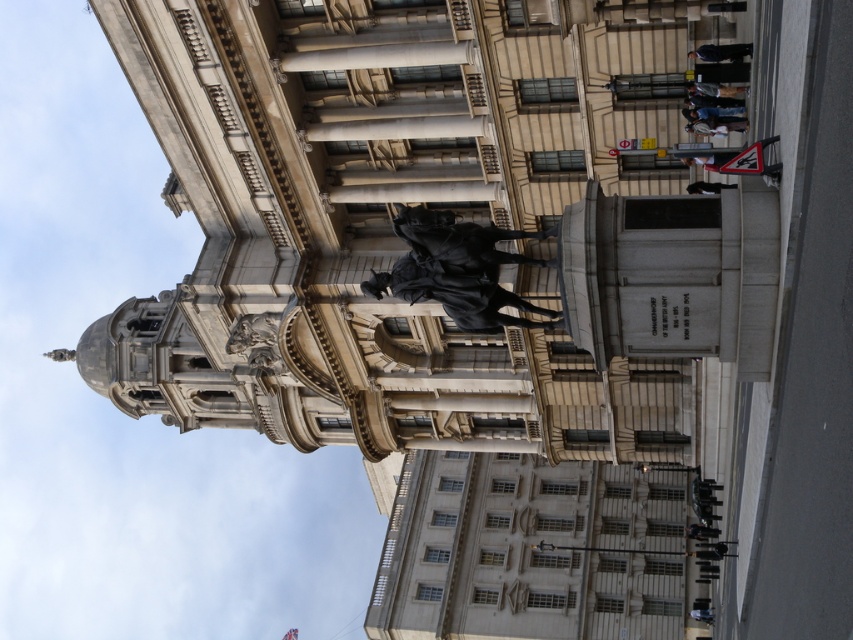
Does polished bronze statue at center have a larger size compared to black leather jacket at upper right?

Yes.

Does polished bronze statue at center have a greater height compared to black leather jacket at upper right?

Yes.

Which is in front, point (410, 273) or point (711, 68)?

Point (410, 273) is more forward.

Where is `polished bronze statue at center`? polished bronze statue at center is located at coordinates (457, 269).

Does polished bronze statue at center have a smaller size compared to black fabric at lower right?

No.

Is polished bronze statue at center to the right of black fabric at lower right from the viewer's perspective?

Incorrect, polished bronze statue at center is not on the right side of black fabric at lower right.

Locate an element on the screen. Image resolution: width=853 pixels, height=640 pixels. polished bronze statue at center is located at coordinates (457, 269).

Who is positioned more to the left, dark gray stone statue at center or dark brown leather jacket at upper right?

Positioned to the left is dark gray stone statue at center.

Does point (705, 58) come farther from viewer compared to point (705, 83)?

No.

Identify the location of dark gray stone statue at center. This screenshot has height=640, width=853. (721, 52).